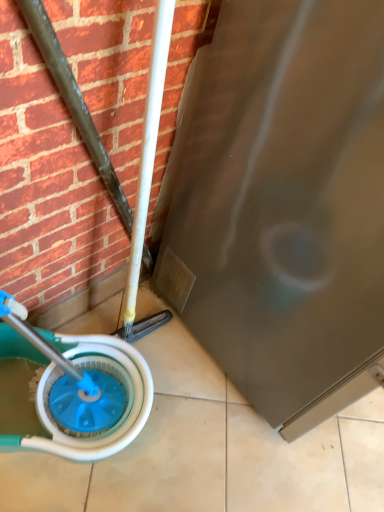
This screenshot has width=384, height=512. Describe the element at coordinates (111, 410) in the screenshot. I see `blue plastic wheel at lower left` at that location.

The width and height of the screenshot is (384, 512). Find the location of `blue plastic wheel at lower left`. blue plastic wheel at lower left is located at coordinates (111, 410).

What is the approximate height of blue plastic wheel at lower left?

The height of blue plastic wheel at lower left is 24.59 centimeters.

You are a GUI agent. You are given a task and a screenshot of the screen. Output one action in this format:
    pyautogui.click(x=<x>, y=<y>)
    Task: Click on the satin silver screen door at lower right
    The width and height of the screenshot is (384, 512).
    Given the screenshot: What is the action you would take?
    pyautogui.click(x=283, y=204)

What do you see at coordinates (283, 204) in the screenshot? I see `satin silver screen door at lower right` at bounding box center [283, 204].

I want to click on blue plastic wheel at lower left, so click(111, 410).

Which is more to the left, satin silver screen door at lower right or blue plastic wheel at lower left?

blue plastic wheel at lower left is more to the left.

In the image, is satin silver screen door at lower right positioned in front of or behind blue plastic wheel at lower left?

satin silver screen door at lower right is in front of blue plastic wheel at lower left.

Which is in front, point (304, 301) or point (123, 415)?

The point (304, 301) is closer to the camera.

From the image's perspective, does satin silver screen door at lower right appear higher than blue plastic wheel at lower left?

Yes, from the image's perspective, satin silver screen door at lower right is over blue plastic wheel at lower left.

From a real-world perspective, is satin silver screen door at lower right positioned over blue plastic wheel at lower left based on gravity?

Yes, from a real-world perspective, satin silver screen door at lower right is above blue plastic wheel at lower left.

Does satin silver screen door at lower right have a lesser width compared to blue plastic wheel at lower left?

No, satin silver screen door at lower right is not thinner than blue plastic wheel at lower left.

Based on the photo, between satin silver screen door at lower right and blue plastic wheel at lower left, which one has more height?

Standing taller between the two is satin silver screen door at lower right.

Who is bigger, satin silver screen door at lower right or blue plastic wheel at lower left?

satin silver screen door at lower right is bigger.

From the picture: Do you think satin silver screen door at lower right is within blue plastic wheel at lower left, or outside of it?

satin silver screen door at lower right is not enclosed by blue plastic wheel at lower left.

Consider the image. Is satin silver screen door at lower right touching blue plastic wheel at lower left?

There is a gap between satin silver screen door at lower right and blue plastic wheel at lower left.

Does satin silver screen door at lower right turn towards blue plastic wheel at lower left?

No, satin silver screen door at lower right is not oriented towards blue plastic wheel at lower left.

How many degrees apart are the facing directions of satin silver screen door at lower right and blue plastic wheel at lower left?

44.8 degrees separate the facing orientations of satin silver screen door at lower right and blue plastic wheel at lower left.

Where is `wheel that appears below the satin silver screen door at lower right (from the image's perspective)`? wheel that appears below the satin silver screen door at lower right (from the image's perspective) is located at coordinates (111, 410).

Which object is positioned more to the left, blue plastic wheel at lower left or satin silver screen door at lower right?

blue plastic wheel at lower left is more to the left.

In the image, is blue plastic wheel at lower left positioned in front of or behind satin silver screen door at lower right?

blue plastic wheel at lower left is behind satin silver screen door at lower right.

Which is closer, (122, 356) or (380, 110)?

The point (380, 110) is in front.

From the image's perspective, between blue plastic wheel at lower left and satin silver screen door at lower right, who is located below?

blue plastic wheel at lower left, from the image's perspective.

From a real-world perspective, is blue plastic wheel at lower left positioned under satin silver screen door at lower right based on gravity?

Yes, from a real-world perspective, blue plastic wheel at lower left is under satin silver screen door at lower right.

Between blue plastic wheel at lower left and satin silver screen door at lower right, which one has smaller width?

blue plastic wheel at lower left.

Does blue plastic wheel at lower left have a greater height compared to satin silver screen door at lower right?

No.

Considering the relative sizes of blue plastic wheel at lower left and satin silver screen door at lower right in the image provided, is blue plastic wheel at lower left bigger than satin silver screen door at lower right?

No.

Which is correct: blue plastic wheel at lower left is inside satin silver screen door at lower right, or outside of it?

blue plastic wheel at lower left lies outside satin silver screen door at lower right.

Are blue plastic wheel at lower left and satin silver screen door at lower right far apart?

Actually, blue plastic wheel at lower left and satin silver screen door at lower right are a little close together.

Is blue plastic wheel at lower left turned away from satin silver screen door at lower right?

No, blue plastic wheel at lower left's orientation is not away from satin silver screen door at lower right.

You are a GUI agent. You are given a task and a screenshot of the screen. Output one action in this format:
    pyautogui.click(x=<x>, y=<y>)
    Task: Click on the screen door that appears above the blue plastic wheel at lower left (from a real-world perspective)
    
    Given the screenshot: What is the action you would take?
    pyautogui.click(x=283, y=204)

This screenshot has height=512, width=384. I want to click on wheel below the satin silver screen door at lower right (from the image's perspective), so click(111, 410).

Image resolution: width=384 pixels, height=512 pixels. Identify the location of wheel below the satin silver screen door at lower right (from a real-world perspective). (111, 410).